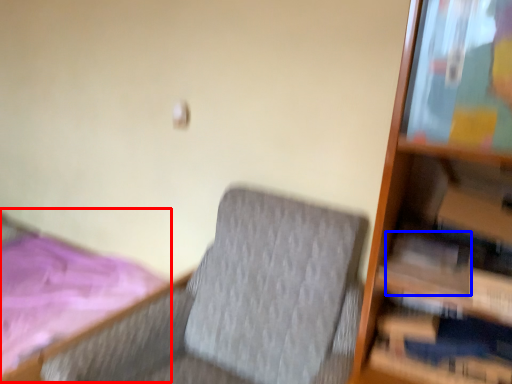
Question: Which point is further to the camera, bed (highlighted by a red box) or paperback book (highlighted by a blue box)?

Choices:
 (A) bed
 (B) paperback book

Answer: (A)